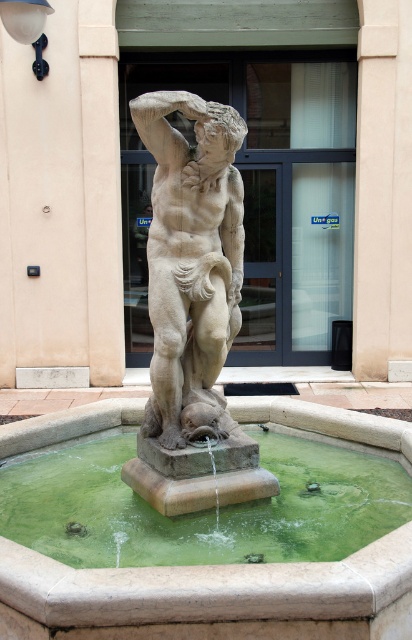
Question: Which point is closer to the camera taking this photo?

Choices:
 (A) (377, 460)
 (B) (231, 218)

Answer: (B)

Question: Which object is farther from the camera taking this photo?

Choices:
 (A) stone statue at center
 (B) green stone water at center
 (C) beige stone pillar at upper center

Answer: (C)

Question: Which of the following is the closest to the observer?

Choices:
 (A) (217, 349)
 (B) (402, 224)
 (C) (109, 435)

Answer: (A)

Question: Does green stone water at center have a greater width compared to beige stone pillar at upper center?

Choices:
 (A) no
 (B) yes

Answer: (B)

Question: Can you confirm if green stone water at center is bigger than beige stone pillar at upper center?

Choices:
 (A) yes
 (B) no

Answer: (B)

Question: Is stone statue at center smaller than beige stone pillar at upper center?

Choices:
 (A) yes
 (B) no

Answer: (A)